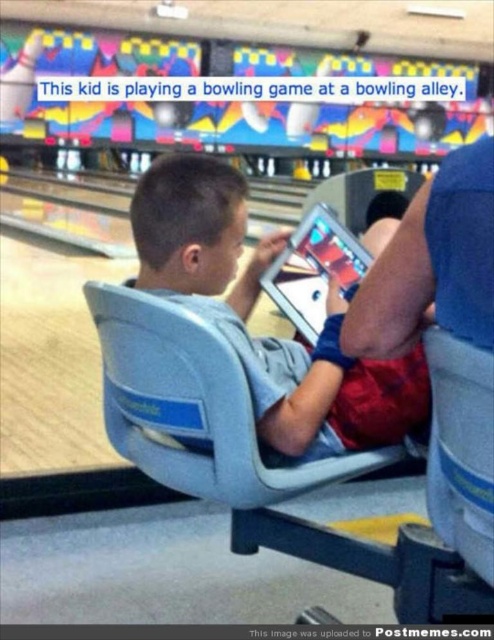
Is point (148, 324) positioned before point (352, 260)?

Yes, point (148, 324) is in front of point (352, 260).

In the scene shown: Who is positioned more to the right, gray plastic chair at center or silver glossy tablet at center?

Positioned to the right is silver glossy tablet at center.

Locate an element on the screen. The width and height of the screenshot is (494, 640). gray plastic chair at center is located at coordinates (195, 404).

Between point (252, 380) and point (145, 445), which one is positioned behind?

Point (145, 445)

Which is more to the left, light blue fabric chair at center or gray plastic chair at center?

gray plastic chair at center is more to the left.

Is point (207, 179) positioned after point (103, 316)?

Yes, point (207, 179) is behind point (103, 316).

Find the location of `light blue fabric chair at center`. light blue fabric chair at center is located at coordinates (250, 310).

Does light blue fabric chair at center have a larger size compared to silver glossy tablet at center?

Indeed, light blue fabric chair at center has a larger size compared to silver glossy tablet at center.

The image size is (494, 640). Describe the element at coordinates (250, 310) in the screenshot. I see `light blue fabric chair at center` at that location.

Between point (385, 410) and point (343, 262), which one is positioned behind?

The point (343, 262) is more distant.

The height and width of the screenshot is (640, 494). I want to click on light blue fabric chair at center, so click(250, 310).